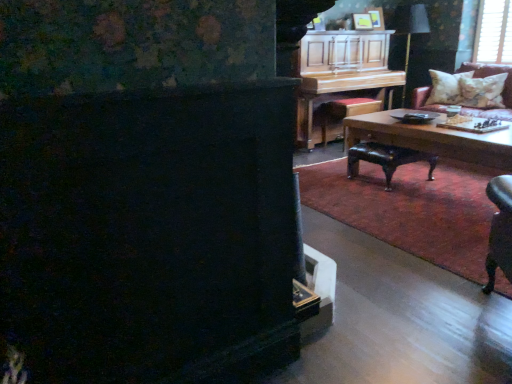
Question: Can you confirm if fluffy beige pillow at upper right, the 2th pillow when ordered from front to back, is bigger than leather couch with floral pillows at upper right?

Choices:
 (A) yes
 (B) no

Answer: (B)

Question: Is fluffy beige pillow at upper right, the 2th pillow when ordered from front to back, shorter than leather couch with floral pillows at upper right?

Choices:
 (A) yes
 (B) no

Answer: (A)

Question: From the image's perspective, is fluffy beige pillow at upper right, positioned as the 1th pillow in back-to-front order, located beneath leather couch with floral pillows at upper right?

Choices:
 (A) no
 (B) yes

Answer: (A)

Question: Can you confirm if fluffy beige pillow at upper right, positioned as the 1th pillow in back-to-front order, is positioned to the left of leather couch with floral pillows at upper right?

Choices:
 (A) no
 (B) yes

Answer: (B)

Question: Could you tell me if fluffy beige pillow at upper right, the 2th pillow when ordered from front to back, is facing leather couch with floral pillows at upper right?

Choices:
 (A) no
 (B) yes

Answer: (B)

Question: Relative to leather stool at center, acting as the second stool starting from the back, is wooden polished coffee table at center in front or behind?

Choices:
 (A) behind
 (B) front

Answer: (B)

Question: From a real-world perspective, is wooden polished coffee table at center positioned above or below leather stool at center, which is the 1th stool from front to back?

Choices:
 (A) below
 (B) above

Answer: (B)

Question: Looking at their shapes, would you say wooden polished coffee table at center is wider or thinner than leather stool at center, which is the 1th stool from front to back?

Choices:
 (A) wide
 (B) thin

Answer: (A)

Question: Is wooden polished coffee table at center inside the boundaries of leather stool at center, which is the 1th stool from bottom to top, or outside?

Choices:
 (A) outside
 (B) inside

Answer: (A)

Question: Relative to wooden stool at center, marked as the 2th stool in a bottom-to-top arrangement, is wooden polished coffee table at center in front or behind?

Choices:
 (A) front
 (B) behind

Answer: (A)

Question: Considering the positions of wooden polished coffee table at center and wooden stool at center, marked as the 2th stool in a bottom-to-top arrangement, in the image, is wooden polished coffee table at center wider or thinner than wooden stool at center, marked as the 2th stool in a bottom-to-top arrangement,?

Choices:
 (A) wide
 (B) thin

Answer: (A)

Question: From the image's perspective, relative to wooden stool at center, the 2th stool viewed from the front, is wooden polished coffee table at center above or below?

Choices:
 (A) below
 (B) above

Answer: (A)

Question: From a real-world perspective, is wooden polished coffee table at center above or below wooden stool at center, placed as the 1th stool when sorted from back to front?

Choices:
 (A) below
 (B) above

Answer: (B)

Question: Is black fabric lampshade at upper right to the left or to the right of matte yellow picture frame at upper center in the image?

Choices:
 (A) right
 (B) left

Answer: (A)

Question: Relative to matte yellow picture frame at upper center, is black fabric lampshade at upper right in front or behind?

Choices:
 (A) behind
 (B) front

Answer: (A)